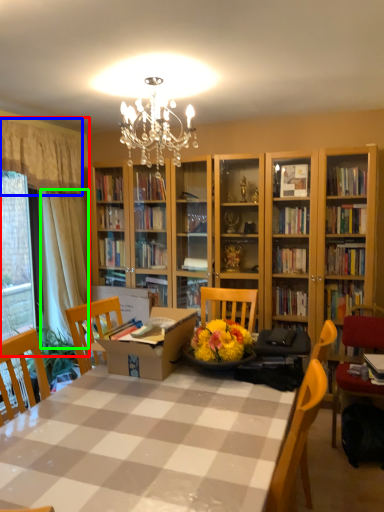
Question: Which is nearer to the curtain (highlighted by a red box)? curtain (highlighted by a blue box) or curtain (highlighted by a green box).

Choices:
 (A) curtain
 (B) curtain

Answer: (B)